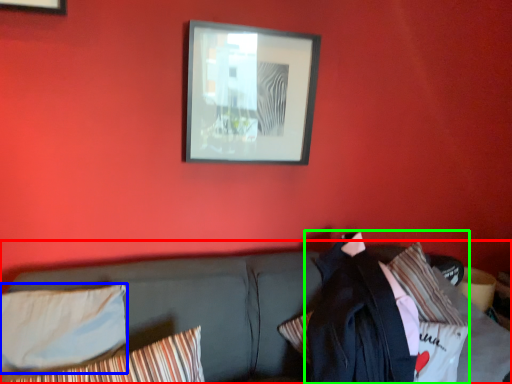
Question: Considering the real-world distances, which object is closest to studio couch (highlighted by a red box)? pillow (highlighted by a blue box) or jacket (highlighted by a green box).

Choices:
 (A) pillow
 (B) jacket

Answer: (A)